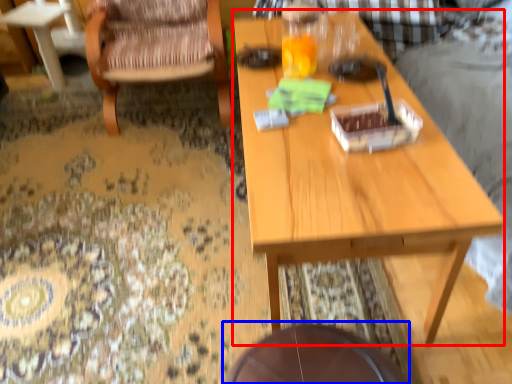
Question: Which point is further to the camera, table (highlighted by a red box) or round table (highlighted by a blue box)?

Choices:
 (A) table
 (B) round table

Answer: (B)